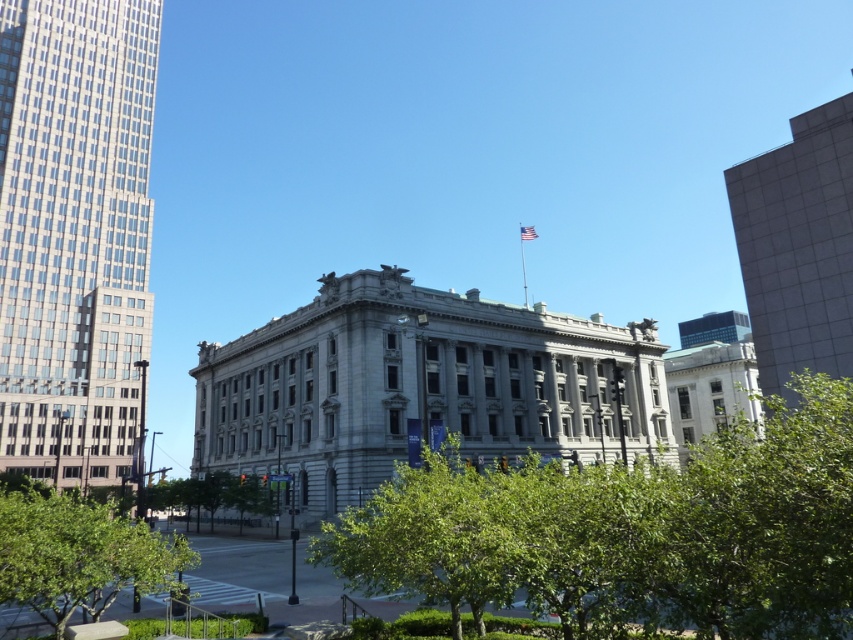
You are standing in front of a grand neoclassical building with symmetrical columns and a flag at the top. You notice two points marked on the image. The first point is at coordinates point (795, 316), and the second is at point (190, 508). If you were to walk from the first point to the second point, would you be moving closer to or farther away from the building?

The point at (795, 316) is in front of the point at (190, 508). Therefore, moving from the first point to the second point would mean moving closer to the building.

You are a photographer trying to capture the grand neoclassical building in the image. However, you notice the green leafy tree at lower left and the glassy steel skyscraper at left are blocking your view. Which object is closer to you, making it the primary obstruction?

The green leafy tree at lower left is behind the glassy steel skyscraper at left, so the glassy steel skyscraper at left is closer to you and is the primary obstruction.

You are standing at the point marked by the coordinates point (x=74, y=236). Looking towards the grand neoclassical building in the image, which direction should you turn to face the glassy steel skyscraper at left?

The glassy steel skyscraper at left is represented by point (x=74, y=236), so if you are standing at that point, you are already facing the glassy steel skyscraper at left. No turn is needed.